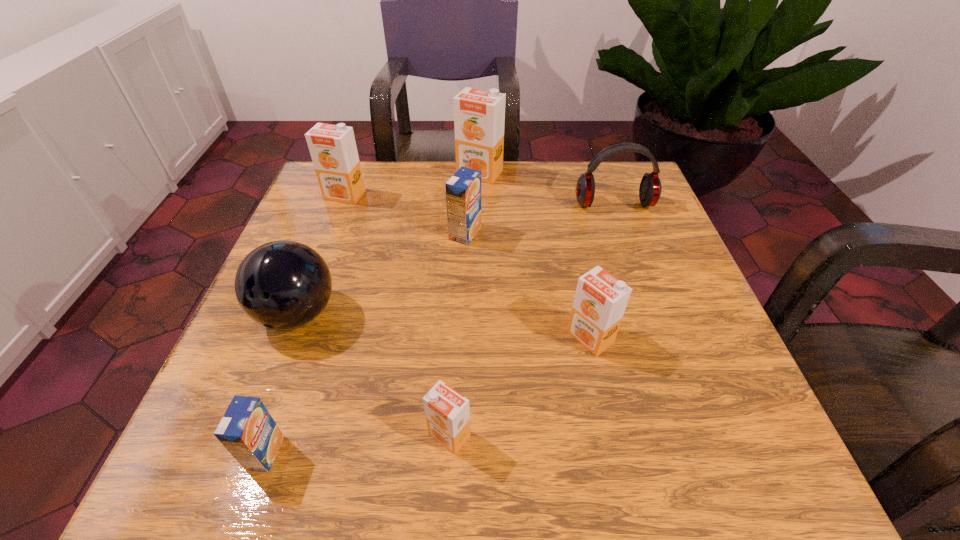
The width and height of the screenshot is (960, 540). I want to click on free space between the smallest orange orange juice and the nearer blue orange_juice, so click(x=357, y=444).

This screenshot has height=540, width=960. I want to click on free space that is in between the nearest orange orange juice and the third nearest orange_juice, so click(x=520, y=386).

Find the location of `empty location between the fifth shortest orange_juice and the smaller blue orange_juice`. empty location between the fifth shortest orange_juice and the smaller blue orange_juice is located at coordinates (305, 324).

At what (x,y) coordinates should I click in order to perform the action: click on the third closest object to the rightmost orange_juice. Please return your answer as a coordinate pair (x, y). Looking at the image, I should click on (650, 188).

Find the location of a particular element. The image size is (960, 540). the third closest object to the red earphone is located at coordinates (600, 300).

At what (x,y) coordinates should I click in order to perform the action: click on orange_juice that is the third nearest to the smaller blue orange_juice. Please return your answer as a coordinate pair (x, y). Image resolution: width=960 pixels, height=540 pixels. Looking at the image, I should click on coord(463,190).

Where is `orange_juice that is the fourth closest to the earphone`? Image resolution: width=960 pixels, height=540 pixels. orange_juice that is the fourth closest to the earphone is located at coordinates (333, 150).

Choose which orange orange juice is the second nearest neighbor to the smallest orange orange juice. Please provide its 2D coordinates. Your answer should be formatted as a tuple, i.e. [(x, y)], where the tuple contains the x and y coordinates of a point satisfying the conditions above.

[(333, 150)]

Locate an element on the screen. orange orange juice that is the third closest one to the black bowling ball is located at coordinates (479, 116).

This screenshot has width=960, height=540. Find the location of `free space in the image that satisfies the following two spatial constraints: 1. on the side of the nearer blue orange_juice with the finger holes; 2. on the right side of the bowling ball`. free space in the image that satisfies the following two spatial constraints: 1. on the side of the nearer blue orange_juice with the finger holes; 2. on the right side of the bowling ball is located at coordinates (245, 453).